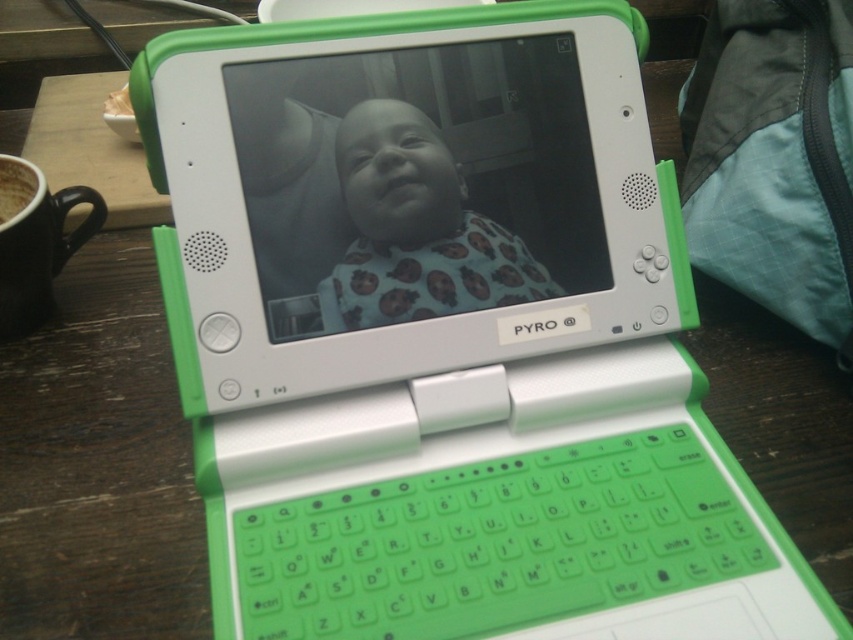
Between matte plastic screen at center and brown matte cup at upper left, which one appears on the right side from the viewer's perspective?

matte plastic screen at center

Which is above, matte plastic screen at center or brown matte cup at upper left?

Positioned higher is brown matte cup at upper left.

Which is behind, point (265, 122) or point (4, 221)?

Positioned behind is point (4, 221).

Where is `matte plastic screen at center`? This screenshot has height=640, width=853. matte plastic screen at center is located at coordinates (419, 179).

Does matte plastic screen at center appear on the right side of blue fabric bib at center?

No, matte plastic screen at center is not to the right of blue fabric bib at center.

What do you see at coordinates (419, 179) in the screenshot? The image size is (853, 640). I see `matte plastic screen at center` at bounding box center [419, 179].

Where is `matte plastic screen at center`? The image size is (853, 640). matte plastic screen at center is located at coordinates (419, 179).

I want to click on blue fabric bib at center, so click(x=416, y=228).

Between blue fabric bib at center and brown matte cup at upper left, which one is positioned lower?

blue fabric bib at center

Locate an element on the screen. This screenshot has height=640, width=853. blue fabric bib at center is located at coordinates (416, 228).